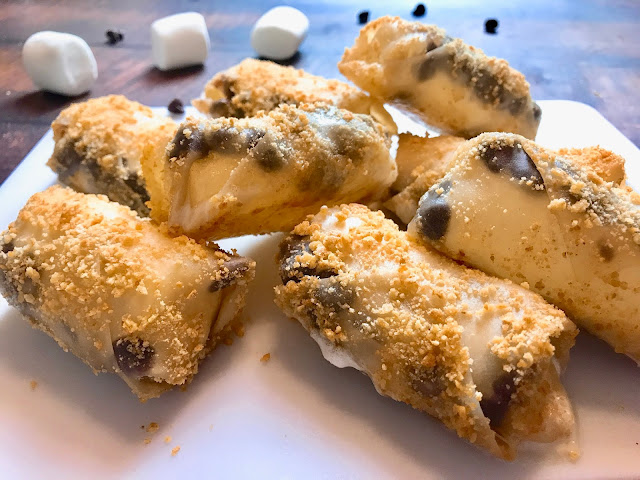
You are a GUI agent. You are given a task and a screenshot of the screen. Output one action in this format:
    pyautogui.click(x=<x>, y=<y>)
    Task: Click on the wooden table
    This screenshot has height=480, width=640.
    Given the screenshot: What is the action you would take?
    pyautogui.click(x=22, y=134)